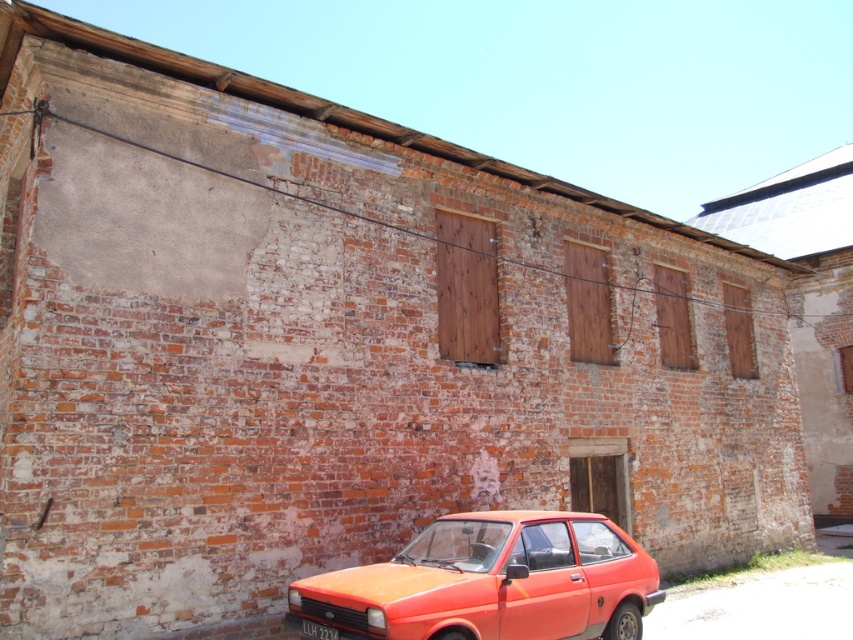
You are standing in front of the weathered brick building and notice the orange matte car at lower center and the yellow plastic license plate at lower center. Which object is positioned to the right of the other?

The orange matte car at lower center is to the right of the yellow plastic license plate at lower center.

You are a delivery person trying to park your orange matte car at lower center in front of the building. However, there is already a yellow plastic license plate at lower center in the spot. Can you park your car there without covering the license plate?

The orange matte car at lower center is positioned over the yellow plastic license plate at lower center, so you cannot park there without covering the license plate.

You are a parking inspector checking the distance between the orange matte car at lower center and the yellow plastic license plate at lower center. The city requires a minimum clearance of 4 feet between vehicles and their license plates for safety. Is the current distance compliant with the regulation?

The distance between the orange matte car at lower center and the yellow plastic license plate at lower center is 3.81 feet, which is less than the required 4 feet. Therefore, it does not comply with the city safety regulations.